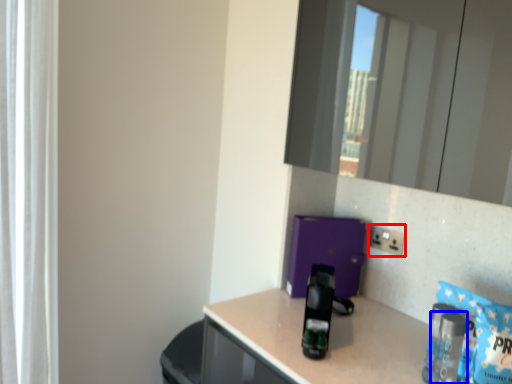
Question: Which object is further to the camera taking this photo, electric outlet (highlighted by a red box) or bottle (highlighted by a blue box)?

Choices:
 (A) electric outlet
 (B) bottle

Answer: (A)